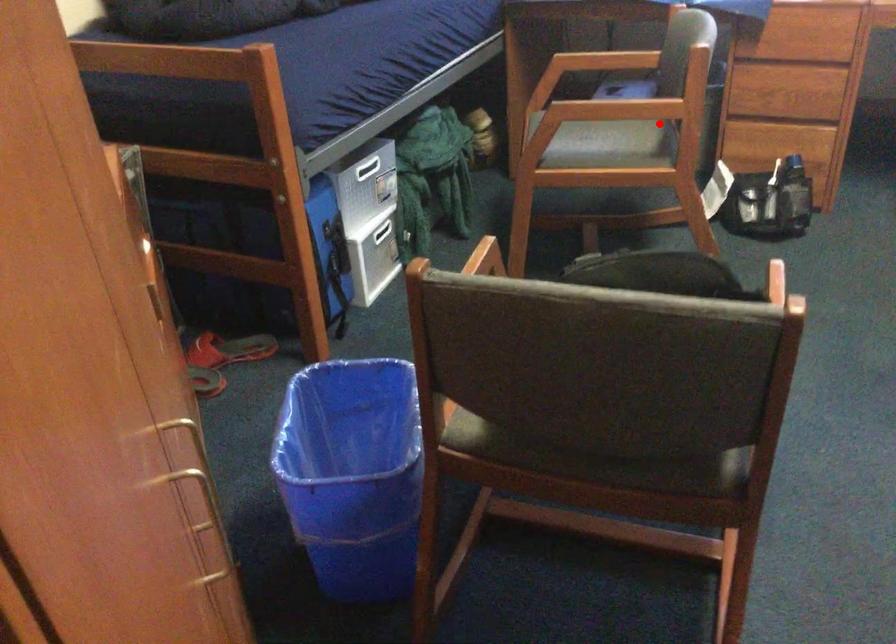
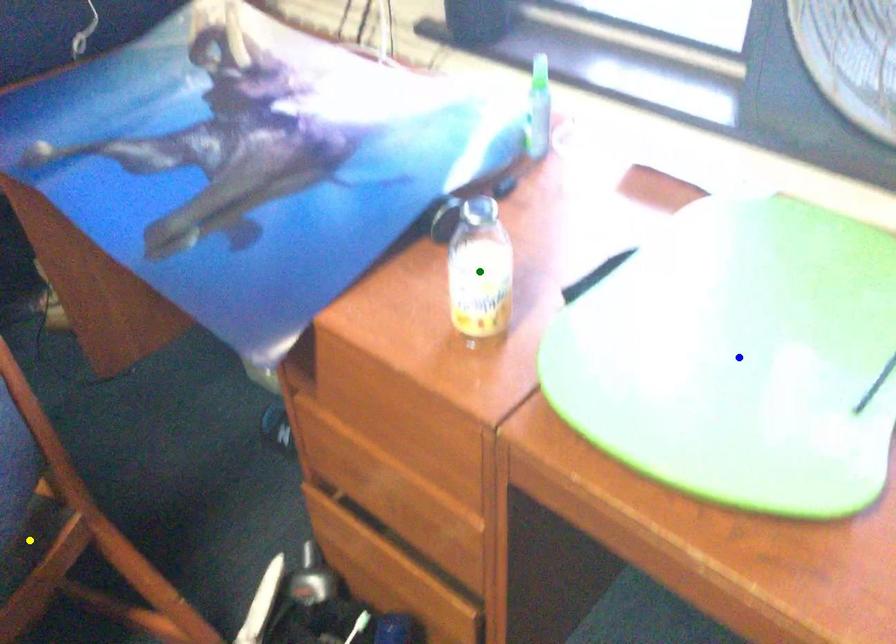
Question: I am providing you with two images of the same scene from different viewpoints. A red point is marked on the first image. You are given multiple points on the second image. Can you choose the point in image 2 that corresponds to the point in image 1?

Choices:
 (A) green point
 (B) yellow point
 (C) blue point

Answer: (B)